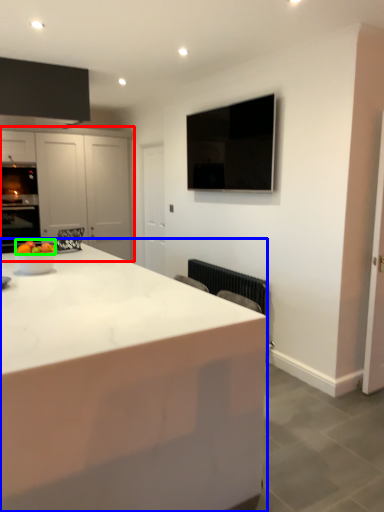
Question: Which object is positioned farthest from cabinetry (highlighted by a red box)? Select from countertop (highlighted by a blue box) and fruit (highlighted by a green box).

Choices:
 (A) countertop
 (B) fruit

Answer: (A)